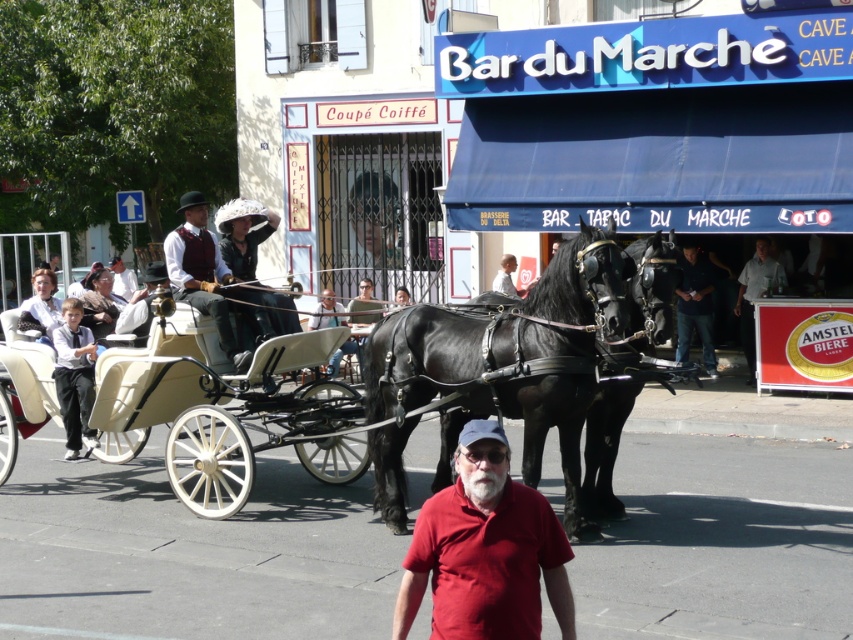
Does black leather horse at center come in front of white dress shirt at left?

Yes, black leather horse at center is in front of white dress shirt at left.

Is black leather horse at center bigger than white dress shirt at left?

Indeed, black leather horse at center has a larger size compared to white dress shirt at left.

Does point (519, 348) come behind point (59, 392)?

That is False.

Where is `black leather horse at center`? The width and height of the screenshot is (853, 640). black leather horse at center is located at coordinates (498, 371).

Between red matte shirt at center and dark blue jeans at center, which one is positioned higher?

dark blue jeans at center is higher up.

This screenshot has height=640, width=853. In order to click on red matte shirt at center in this screenshot , I will do `click(485, 550)`.

Locate an element on the screen. This screenshot has height=640, width=853. red matte shirt at center is located at coordinates (485, 550).

Who is shorter, white dress shirt at left or gray fabric shirt at center?

Standing shorter between the two is white dress shirt at left.

The width and height of the screenshot is (853, 640). Describe the element at coordinates (74, 378) in the screenshot. I see `white dress shirt at left` at that location.

Where is `white dress shirt at left`? This screenshot has width=853, height=640. white dress shirt at left is located at coordinates (74, 378).

Identify the location of white dress shirt at left. This screenshot has height=640, width=853. (74, 378).